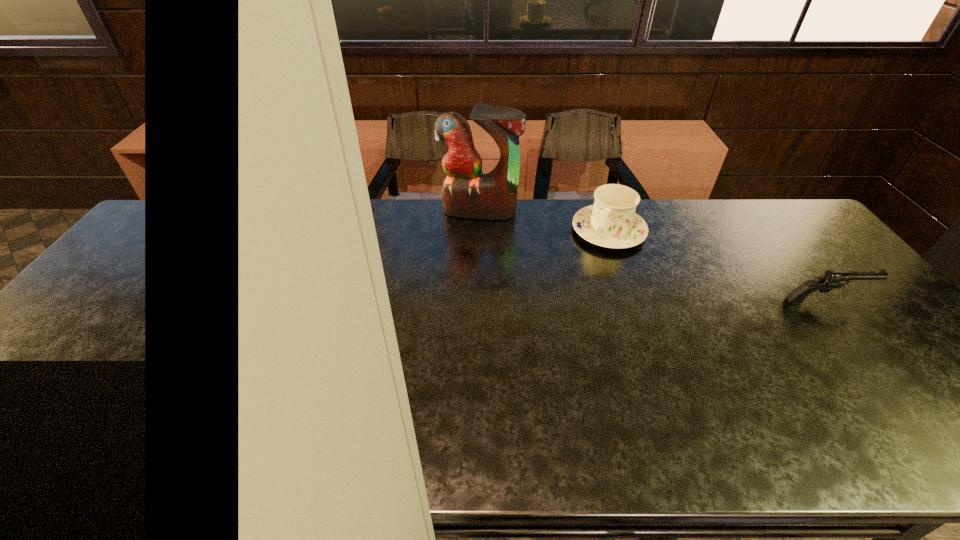
Identify the location of the shortest object. click(x=831, y=279).

I want to click on the nearest object, so click(x=831, y=279).

At what (x,y) coordinates should I click in order to perform the action: click on the second shortest object. Please return your answer as a coordinate pair (x, y). This screenshot has width=960, height=540. Looking at the image, I should click on (611, 222).

The image size is (960, 540). What are the coordinates of `the second object from left to right` in the screenshot? It's located at (611, 222).

Where is `the tallest object`? the tallest object is located at coordinates click(466, 192).

At what (x,y) coordinates should I click in order to perform the action: click on parrot. Please return your answer as a coordinate pair (x, y). The height and width of the screenshot is (540, 960). Looking at the image, I should click on (466, 192).

Locate an element on the screen. The height and width of the screenshot is (540, 960). free region located 0.300m on the handle side of the chinaware is located at coordinates (554, 310).

Identify the location of free space located on the handle side of the chinaware. The image size is (960, 540). (567, 291).

At what (x,y) coordinates should I click in order to perform the action: click on vacant area situated on the handle side of the chinaware. Please return your answer as a coordinate pair (x, y). Looking at the image, I should click on (541, 330).

Find the location of a particular element. The width and height of the screenshot is (960, 540). vacant space situated 0.400m at the face of the parrot is located at coordinates (443, 307).